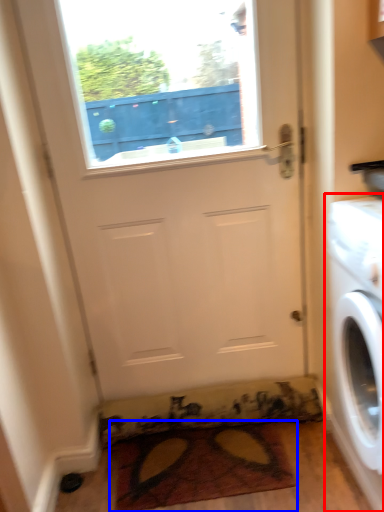
Question: Among these objects, which one is farthest to the camera, washing machine (highlighted by a red box) or doormat (highlighted by a blue box)?

Choices:
 (A) washing machine
 (B) doormat

Answer: (B)